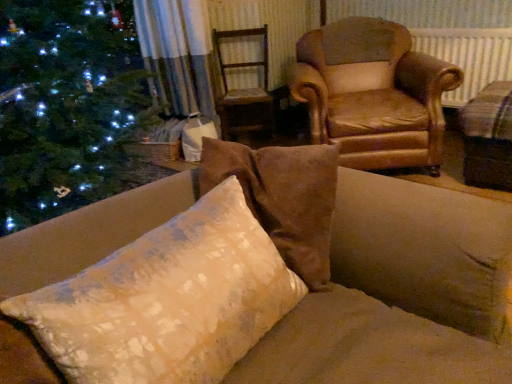
Question: Is beige fabric cushion at right thinner than wooden swivel chair at center?

Choices:
 (A) yes
 (B) no

Answer: (B)

Question: From a real-world perspective, is beige fabric cushion at right under wooden swivel chair at center?

Choices:
 (A) no
 (B) yes

Answer: (B)

Question: Is the depth of beige fabric cushion at right less than that of wooden swivel chair at center?

Choices:
 (A) no
 (B) yes

Answer: (B)

Question: Is beige fabric cushion at right wider than wooden swivel chair at center?

Choices:
 (A) yes
 (B) no

Answer: (A)

Question: Is beige fabric cushion at right turned away from wooden swivel chair at center?

Choices:
 (A) no
 (B) yes

Answer: (A)

Question: Can you confirm if beige fabric cushion at right is positioned to the left of wooden swivel chair at center?

Choices:
 (A) no
 (B) yes

Answer: (A)

Question: Does textured cream pillow at center come in front of wooden swivel chair at center?

Choices:
 (A) no
 (B) yes

Answer: (B)

Question: Is textured cream pillow at center facing towards wooden swivel chair at center?

Choices:
 (A) no
 (B) yes

Answer: (A)

Question: Does textured cream pillow at center have a smaller size compared to wooden swivel chair at center?

Choices:
 (A) no
 (B) yes

Answer: (B)

Question: From the image's perspective, does textured cream pillow at center appear lower than wooden swivel chair at center?

Choices:
 (A) yes
 (B) no

Answer: (A)

Question: Is textured cream pillow at center far away from wooden swivel chair at center?

Choices:
 (A) yes
 (B) no

Answer: (A)

Question: Can you confirm if textured cream pillow at center is thinner than wooden swivel chair at center?

Choices:
 (A) no
 (B) yes

Answer: (B)

Question: From the image's perspective, is textured cream pillow at center located beneath beige fabric cushion at right?

Choices:
 (A) yes
 (B) no

Answer: (A)